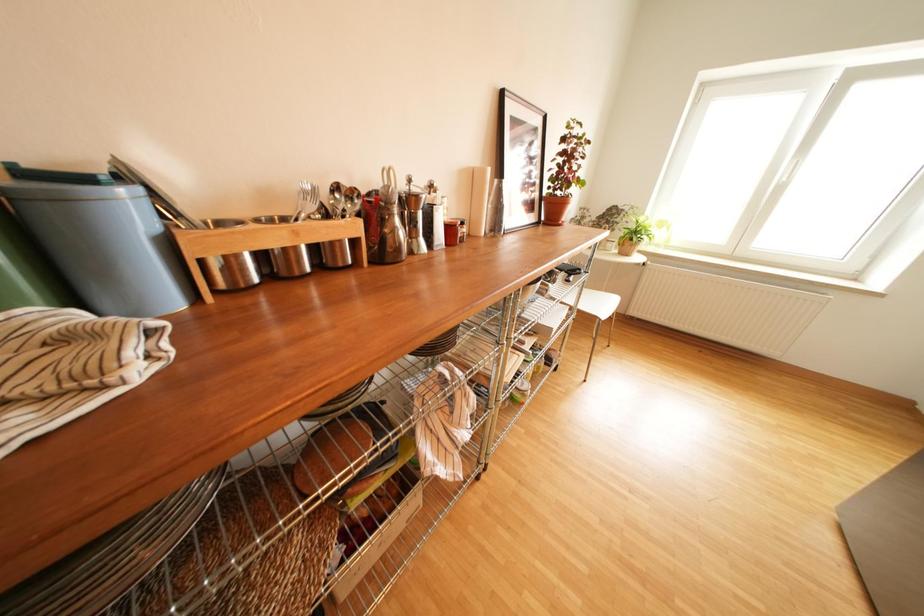
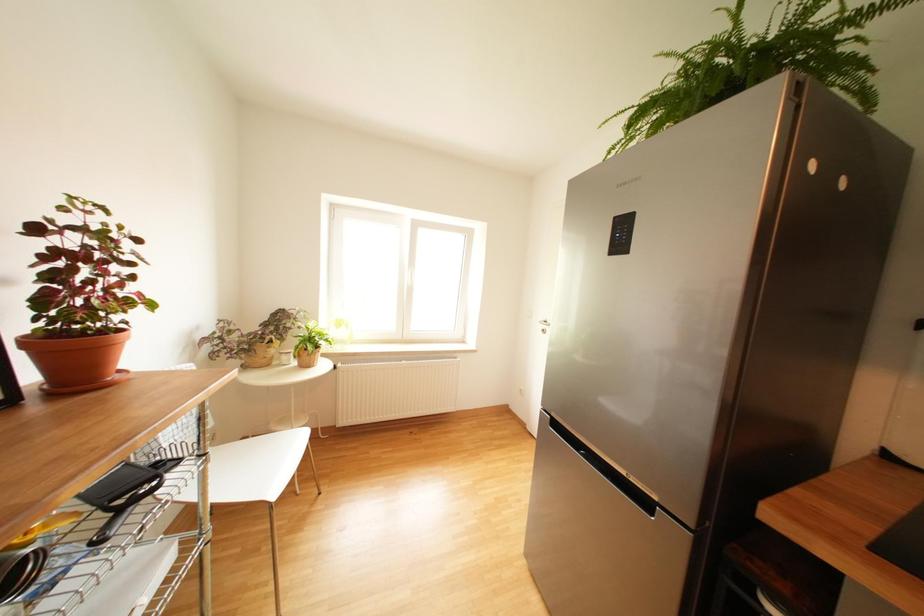
Question: The camera is either moving clockwise (left) or counter-clockwise (right) around the object. The first image is from the beginning of the video and the second image is from the end. Is the camera moving left or right when shooting the video?

Choices:
 (A) Left
 (B) Right

Answer: (A)